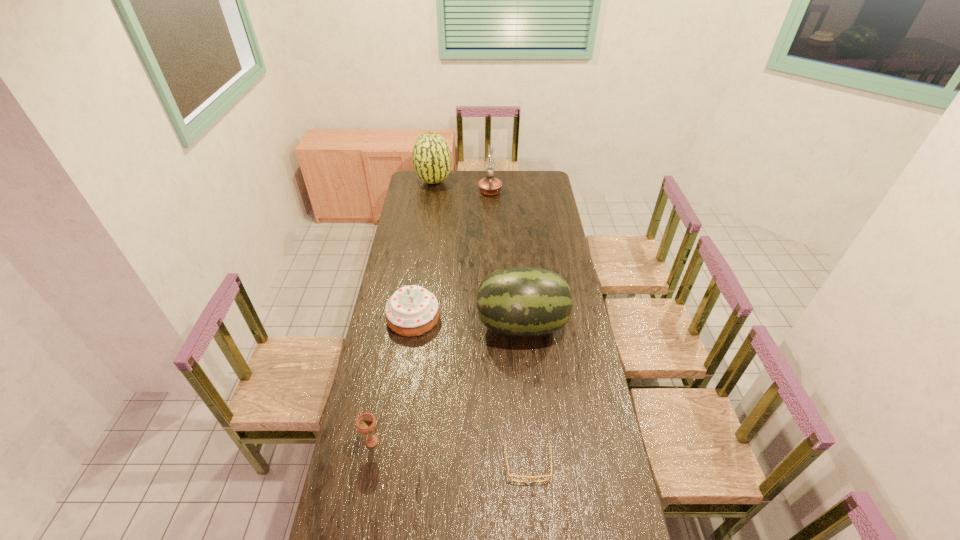
Locate which object is the fifth closest to the cake. Please provide its 2D coordinates. Your answer should be formatted as a tuple, i.e. [(x, y)], where the tuple contains the x and y coordinates of a point satisfying the conditions above.

[(431, 156)]

I want to click on object identified as the fifth closest to the oil lamp, so 528,477.

The image size is (960, 540). What are the coordinates of `blank space that satisfies the following two spatial constraints: 1. on the front side of the right watermelon; 2. on the right side of the oil lamp` in the screenshot? It's located at (494, 325).